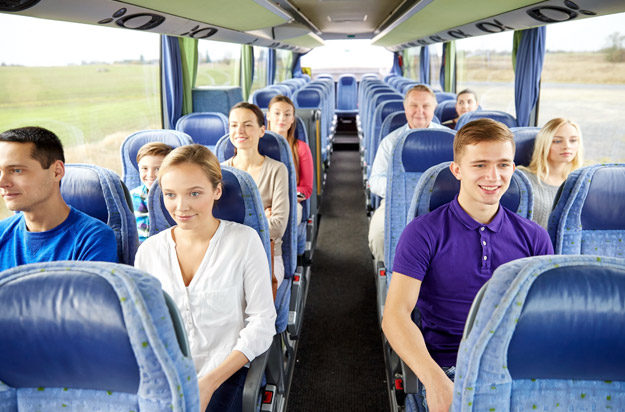
Locate an element on the screen. Image resolution: width=625 pixels, height=412 pixels. green curtain is located at coordinates (182, 60), (242, 59), (287, 63), (405, 62), (448, 72), (515, 48).